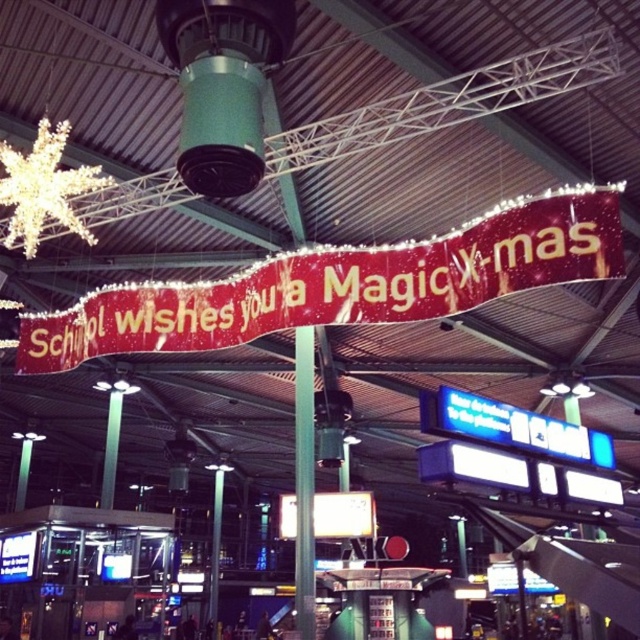
Question: Which point is closer to the camera?

Choices:
 (A) (376, 305)
 (B) (308, 570)

Answer: (A)

Question: Is shiny red banner at center above green metallic pole at center?

Choices:
 (A) no
 (B) yes

Answer: (B)

Question: Which point is farther to the camera?

Choices:
 (A) shiny red banner at center
 (B) green metallic pole at center

Answer: (B)

Question: Does shiny red banner at center come in front of green metallic pole at center?

Choices:
 (A) no
 (B) yes

Answer: (B)

Question: Does shiny red banner at center appear on the right side of green metallic pole at center?

Choices:
 (A) no
 (B) yes

Answer: (A)